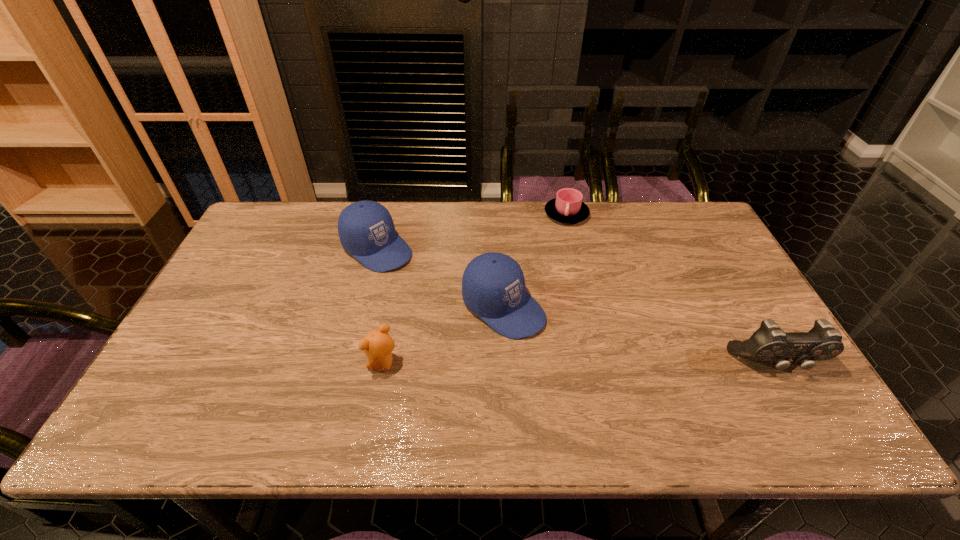
Identify the location of vacant space on the desktop that is between the teddy bear and the control and is positioned on the side with the handle of the cup. This screenshot has width=960, height=540. (615, 364).

Find the location of a particular element. The height and width of the screenshot is (540, 960). vacant spot on the desktop that is between the teddy bear and the control and is positioned on the front-facing side of the right cap is located at coordinates (581, 364).

Locate an element on the screen. vacant space on the desktop that is between the teddy bear and the rightmost object and is positioned on the front-facing side of the left cap is located at coordinates (534, 364).